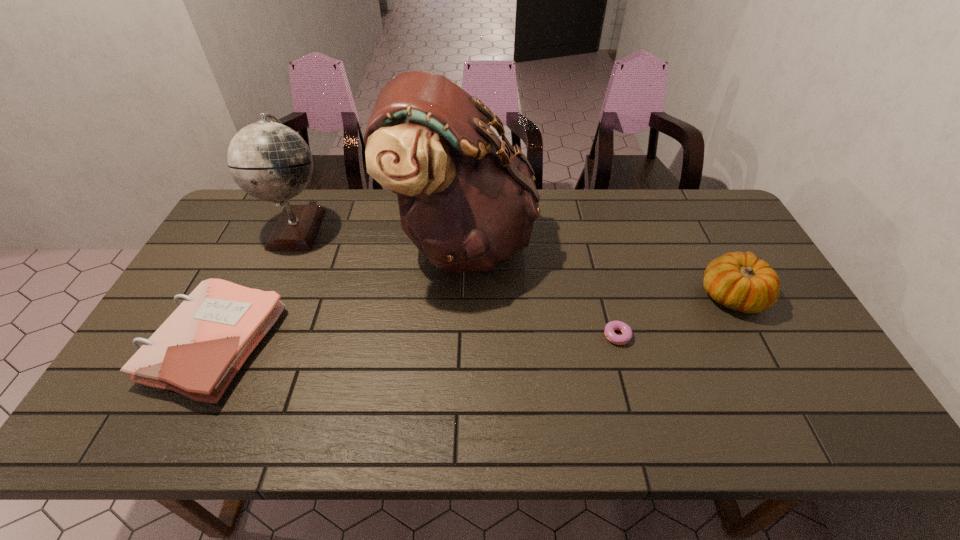
Image resolution: width=960 pixels, height=540 pixels. In order to click on free space between the second tallest object and the doughnut in this screenshot , I will do `click(458, 281)`.

Identify the location of free spot between the rightmost object and the second object from right to left. (676, 316).

The image size is (960, 540). I want to click on vacant point located between the doughnut and the phonebook, so click(x=416, y=340).

Where is `free space between the phonebook and the globe`? Image resolution: width=960 pixels, height=540 pixels. free space between the phonebook and the globe is located at coordinates (255, 286).

Locate an element on the screen. The height and width of the screenshot is (540, 960). unoccupied area between the rightmost object and the third object from right to left is located at coordinates (597, 268).

Where is `free space between the rightmost object and the fourth tallest object`? This screenshot has width=960, height=540. free space between the rightmost object and the fourth tallest object is located at coordinates (472, 320).

The width and height of the screenshot is (960, 540). Identify the location of object that is the third closest to the rightmost object. (268, 160).

Where is `the second closest object to the second tallest object`? The width and height of the screenshot is (960, 540). the second closest object to the second tallest object is located at coordinates (467, 200).

The height and width of the screenshot is (540, 960). I want to click on free space that satisfies the following two spatial constraints: 1. at the front of the rightmost object with buckles; 2. on the left side of the third object from right to left, so 460,296.

The height and width of the screenshot is (540, 960). In order to click on free point that satisfies the following two spatial constraints: 1. at the equator of the gourd; 2. on the left side of the second tallest object in this screenshot , I will do `click(267, 296)`.